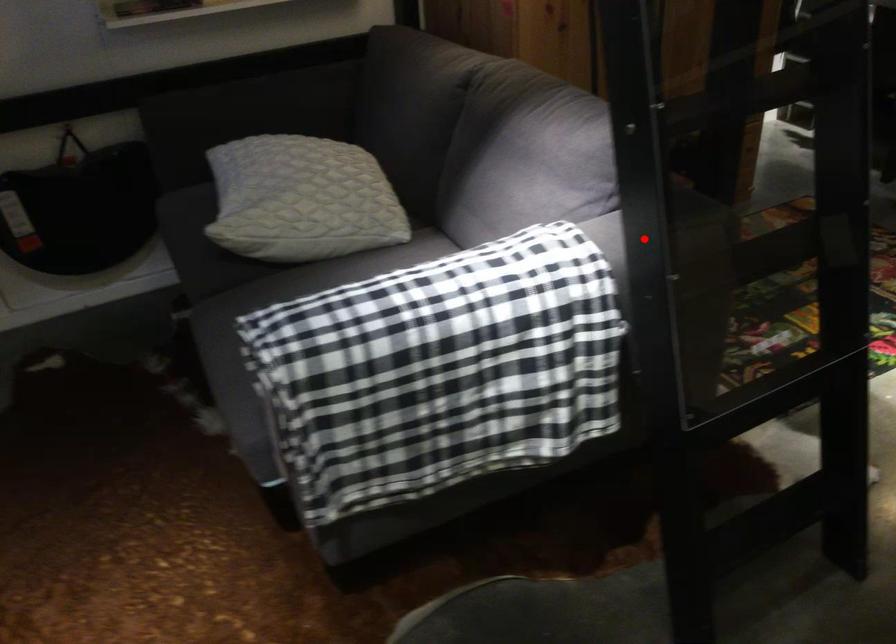
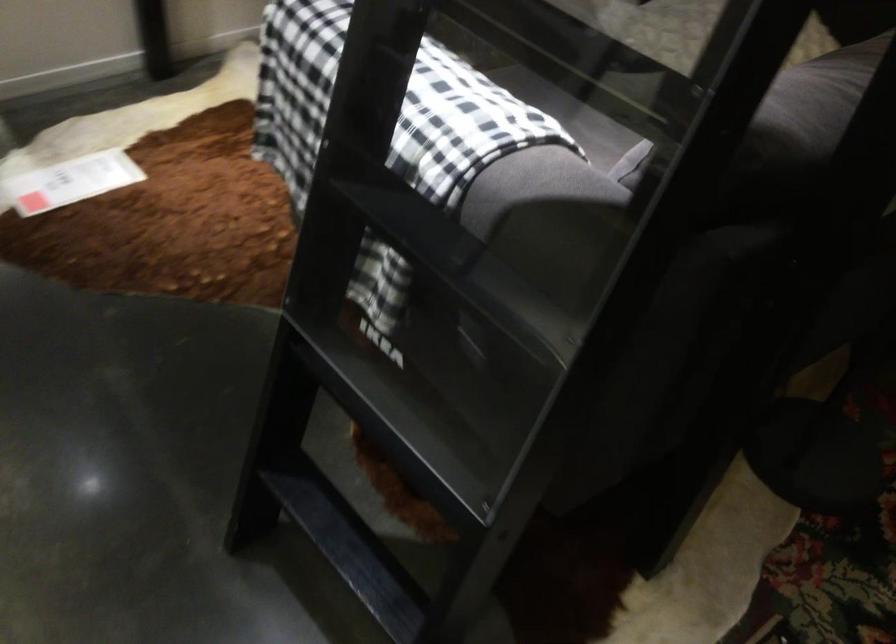
The point at the highlighted location is marked in the first image. Where is the corresponding point in the second image?

(384, 107)